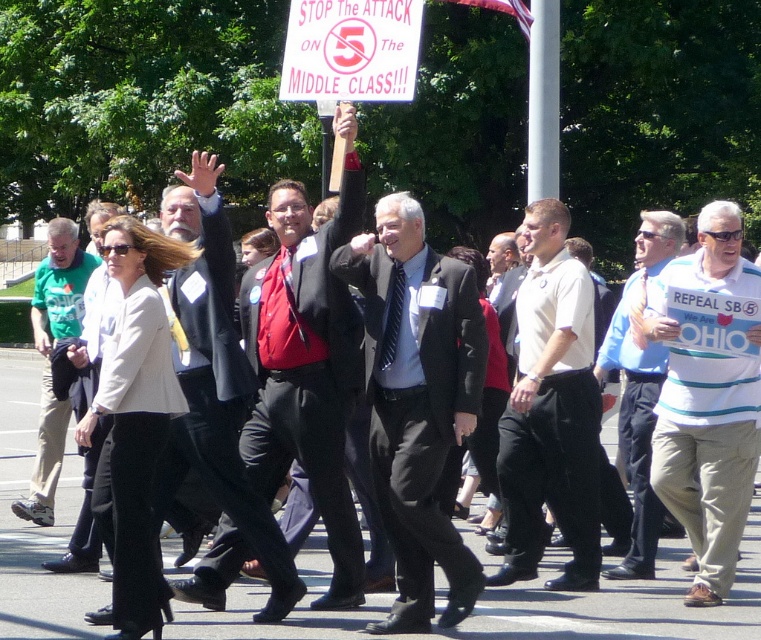
Question: Does white striped shirt at center appear over blue striped shirt at center?

Choices:
 (A) no
 (B) yes

Answer: (A)

Question: Which object is positioned farthest from the dark gray suit at center?

Choices:
 (A) green cotton shirt at left
 (B) blue striped shirt at center
 (C) white striped shirt at center
 (D) white shirt at center

Answer: (A)

Question: Which is nearer to the matte black suit at center?

Choices:
 (A) dark gray suit at center
 (B) white shirt at center

Answer: (A)

Question: Which object is positioned farthest from the white striped shirt at center?

Choices:
 (A) white shirt at center
 (B) dark gray suit at center

Answer: (B)

Question: Is white striped shirt at center thinner than green cotton shirt at left?

Choices:
 (A) yes
 (B) no

Answer: (A)

Question: Is dark gray suit at center above blue striped shirt at center?

Choices:
 (A) yes
 (B) no

Answer: (B)